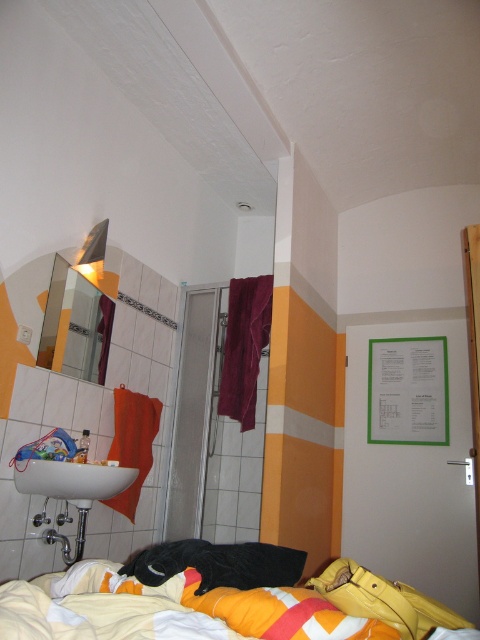
From the picture: Which of these two, yellow fabric bed at lower center or green paperboard at right, stands taller?

With more height is green paperboard at right.

Is yellow fabric bed at lower center positioned at the back of green paperboard at right?

That is False.

What do you see at coordinates (168, 609) in the screenshot?
I see `yellow fabric bed at lower center` at bounding box center [168, 609].

This screenshot has height=640, width=480. In order to click on yellow fabric bed at lower center in this screenshot , I will do `click(168, 609)`.

Does point (193, 577) come farther from viewer compared to point (54, 496)?

No, (193, 577) is closer to viewer.

Which is above, yellow fabric bed at lower center or white glossy sink at lower left?

yellow fabric bed at lower center

Is point (96, 595) behind point (108, 484)?

No, (96, 595) is in front of (108, 484).

The width and height of the screenshot is (480, 640). Identify the location of yellow fabric bed at lower center. (168, 609).

Between point (67, 342) and point (27, 490), which one is positioned behind?

The point (67, 342) is more distant.

This screenshot has width=480, height=640. In order to click on clear glass mirror at upper left in this screenshot , I will do `click(75, 324)`.

Identify the location of clear glass mirror at upper left. (75, 324).